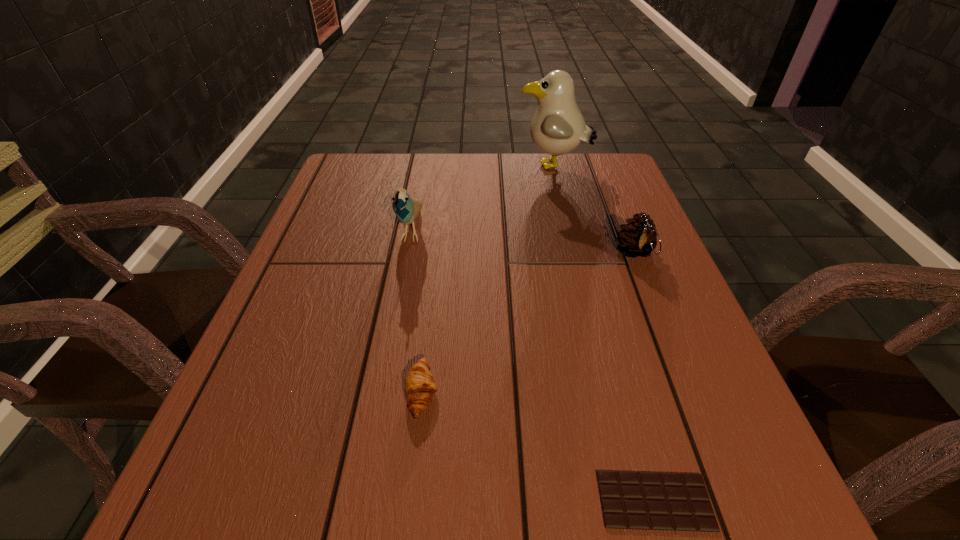
At what (x,y) coordinates should I click in order to perform the action: click on free spot located 0.270m on the beak of the tallest object. Please return your answer as a coordinate pair (x, y). Image resolution: width=960 pixels, height=540 pixels. Looking at the image, I should click on (422, 167).

You are a GUI agent. You are given a task and a screenshot of the screen. Output one action in this format:
    pyautogui.click(x=<x>, y=<y>)
    Task: Click on the vacant region located 0.270m on the beak of the tallest object
    The image size is (960, 540).
    Given the screenshot: What is the action you would take?
    pyautogui.click(x=422, y=167)

Locate an element on the screen. Image resolution: width=960 pixels, height=540 pixels. free region located at the face of the second tallest object is located at coordinates (391, 340).

I want to click on blank space located 0.050m with a leaf charm attached to the third tallest object, so click(647, 285).

Identify the location of free spot located on the front-facing side of the fourth farthest object. The width and height of the screenshot is (960, 540). (517, 393).

At what (x,y) coordinates should I click in order to perform the action: click on free space located 0.080m on the right of the shortest object. Please return your answer as a coordinate pair (x, y). This screenshot has height=540, width=960. Looking at the image, I should click on (769, 501).

I want to click on object positioned at the far edge, so click(558, 127).

What are the coordinates of `object that is at the near edge` in the screenshot? It's located at (630, 500).

Locate an element on the screen. This screenshot has width=960, height=540. gull that is at the right edge is located at coordinates (558, 127).

In order to click on pinecone located in the right edge section of the desktop in this screenshot , I will do `click(637, 238)`.